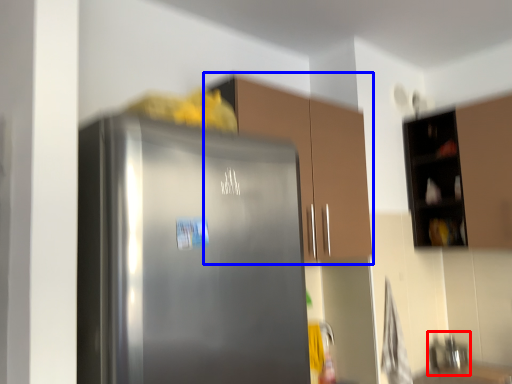
Question: Which object is closer to the camera taking this photo, sink (highlighted by a red box) or cabinetry (highlighted by a blue box)?

Choices:
 (A) sink
 (B) cabinetry

Answer: (B)